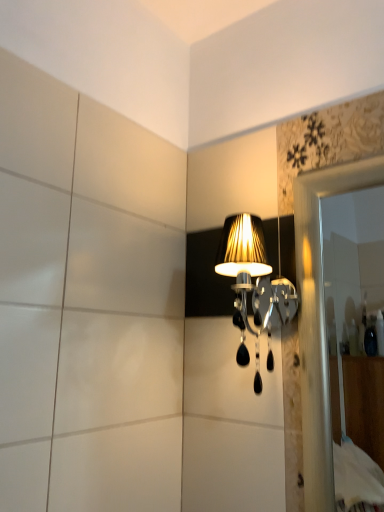
Image resolution: width=384 pixels, height=512 pixels. Describe the element at coordinates (251, 279) in the screenshot. I see `shiny chrome lamp at upper center` at that location.

In order to click on shiny chrome lamp at upper center in this screenshot , I will do `click(251, 279)`.

This screenshot has width=384, height=512. I want to click on shiny chrome lamp at upper center, so click(251, 279).